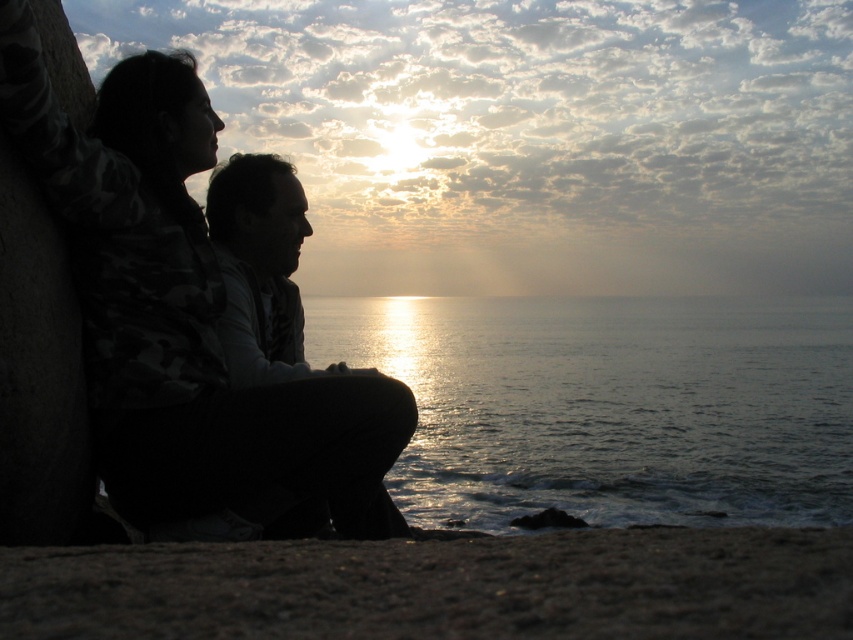
Question: Which of the following is the farthest from the observer?

Choices:
 (A) (817, 621)
 (B) (802, 369)
 (C) (209, 362)

Answer: (B)

Question: Is silhouette clothing at left wider than dark sand at lower center?

Choices:
 (A) yes
 (B) no

Answer: (B)

Question: Estimate the real-world distances between objects in this image. Which object is farther from the silhouette man at center?

Choices:
 (A) silhouette clothing at left
 (B) glistening silver water at center
 (C) dark sand at lower center

Answer: (B)

Question: Is glistening silver water at center closer to camera compared to silhouette clothing at left?

Choices:
 (A) no
 (B) yes

Answer: (A)

Question: Can you confirm if glistening silver water at center is bigger than silhouette man at center?

Choices:
 (A) yes
 (B) no

Answer: (A)

Question: Which point is closer to the camera?

Choices:
 (A) (200, 416)
 (B) (248, 337)
 (C) (399, 314)
 (D) (792, 532)

Answer: (D)